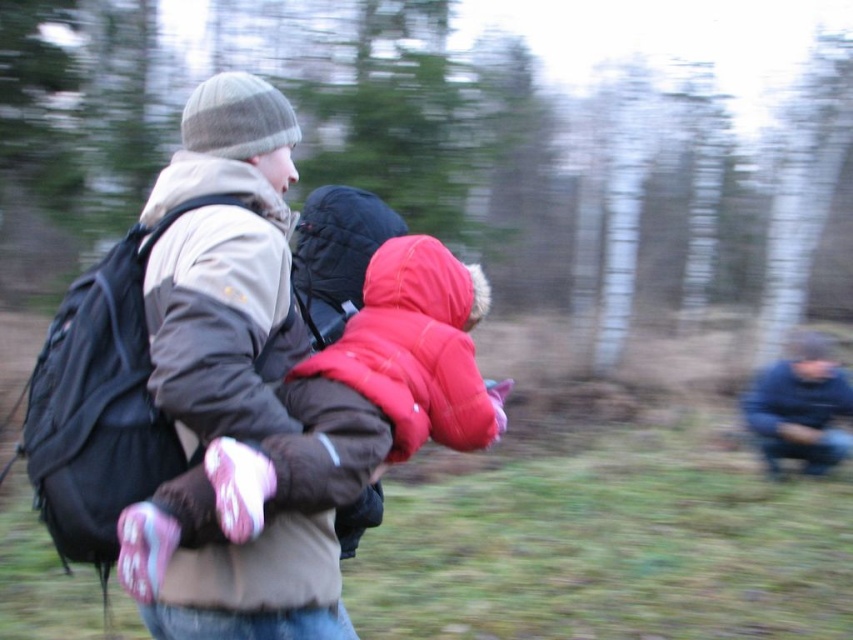
Does matte red jacket at center have a lesser width compared to blue matte jacket at lower right?

Yes.

Which is above, matte red jacket at center or blue matte jacket at lower right?

matte red jacket at center is above.

The image size is (853, 640). In order to click on matte red jacket at center in this screenshot , I will do click(x=415, y=348).

Looking at this image, is the position of black fabric backpack at left more distant than that of matte red jacket at center?

No, black fabric backpack at left is closer to the viewer.

The height and width of the screenshot is (640, 853). Identify the location of black fabric backpack at left. (102, 401).

At what (x,y) coordinates should I click in order to perform the action: click on black fabric backpack at left. Please return your answer as a coordinate pair (x, y). The width and height of the screenshot is (853, 640). Looking at the image, I should click on (102, 401).

In the scene shown: Is red fleece jacket at center to the left of black fabric backpack at left from the viewer's perspective?

Incorrect, red fleece jacket at center is not on the left side of black fabric backpack at left.

Based on the photo, is red fleece jacket at center shorter than black fabric backpack at left?

Correct, red fleece jacket at center is not as tall as black fabric backpack at left.

Is point (129, 532) more distant than point (53, 416)?

No, it is in front of (53, 416).

Image resolution: width=853 pixels, height=640 pixels. I want to click on red fleece jacket at center, so click(x=339, y=413).